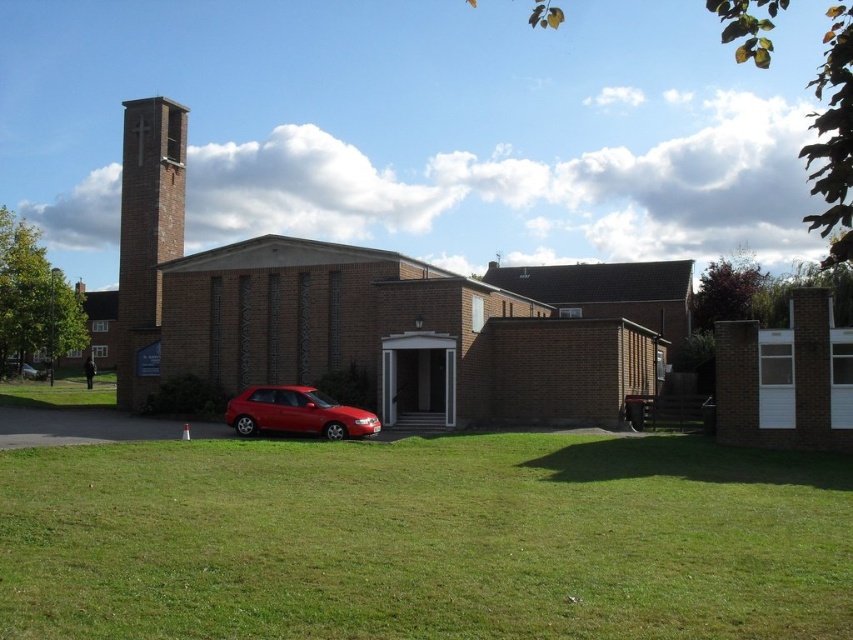
Question: Which point is farther from the camera taking this photo?

Choices:
 (A) (230, 417)
 (B) (135, 116)
 (C) (573, 416)

Answer: (B)

Question: Which point is closer to the camera?

Choices:
 (A) (125, 355)
 (B) (315, 580)
 (C) (323, 436)

Answer: (B)

Question: Is green grass at lower center smaller than brick church at center?

Choices:
 (A) yes
 (B) no

Answer: (A)

Question: Can you confirm if brick church at center is positioned above brick bell tower at left?

Choices:
 (A) yes
 (B) no

Answer: (B)

Question: Estimate the real-world distances between objects in this image. Which object is closer to the green grass at lower center?

Choices:
 (A) brick bell tower at left
 (B) shiny red hatchback at lower left
 (C) brick church at center

Answer: (B)

Question: From the image, what is the correct spatial relationship of brick bell tower at left in relation to shiny red hatchback at lower left?

Choices:
 (A) above
 (B) below

Answer: (A)